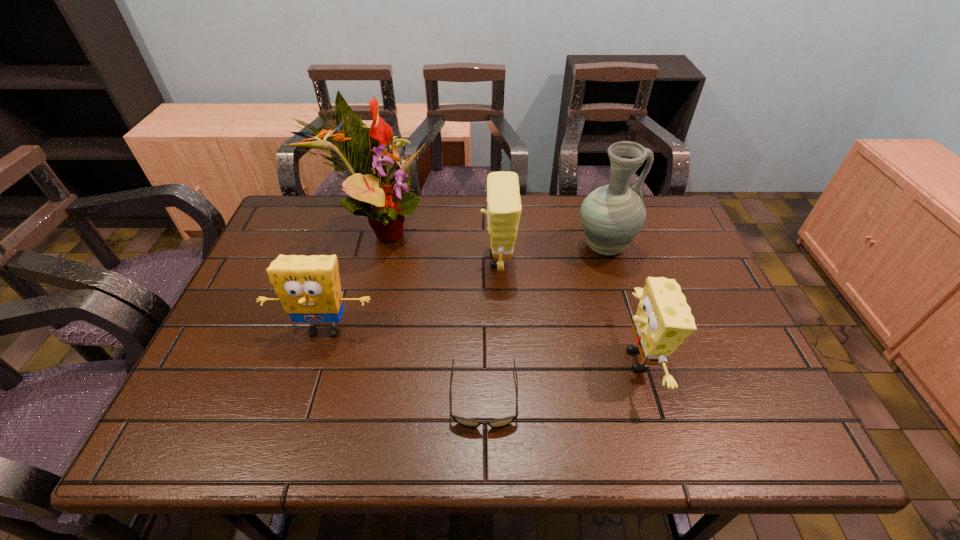
At what (x,y) coordinates should I click in order to perform the action: click on bouquet present at the left edge. Please return your answer as a coordinate pair (x, y). The image size is (960, 540). Looking at the image, I should click on (367, 153).

This screenshot has height=540, width=960. In order to click on sponge at the left edge in this screenshot , I will do point(309,288).

Where is `object present at the far left corner`? The height and width of the screenshot is (540, 960). object present at the far left corner is located at coordinates (367, 153).

Identify the location of free space at the far edge of the desktop. (444, 224).

Locate an element on the screen. The image size is (960, 540). vacant space at the left edge of the desktop is located at coordinates (263, 251).

Image resolution: width=960 pixels, height=540 pixels. Find the location of `free location at the right edge`. free location at the right edge is located at coordinates (699, 291).

This screenshot has height=540, width=960. I want to click on free space at the near right corner of the desktop, so click(x=744, y=438).

This screenshot has width=960, height=540. Find the location of `free point between the rightmost sponge and the leftmost sponge`. free point between the rightmost sponge and the leftmost sponge is located at coordinates (481, 345).

The width and height of the screenshot is (960, 540). Find the location of `empty space that is in between the fifth shortest object and the leftmost sponge`. empty space that is in between the fifth shortest object and the leftmost sponge is located at coordinates (464, 289).

Identify the location of vacant area between the tallest object and the farthest sponge. The height and width of the screenshot is (540, 960). pyautogui.click(x=437, y=245).